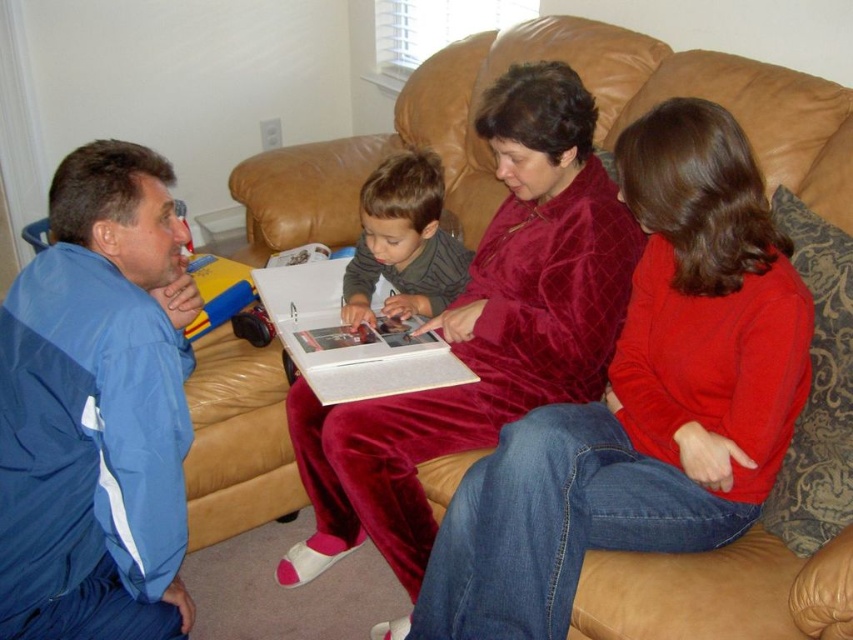
Question: In this image, where is velvet red sweater at center located relative to velvet maroon pajamas at center?

Choices:
 (A) right
 (B) left

Answer: (A)

Question: Is velvet red sweater at center closer to camera compared to velvet-like sweater at center?

Choices:
 (A) no
 (B) yes

Answer: (B)

Question: Which object is farther from the camera taking this photo?

Choices:
 (A) velvet maroon pajamas at center
 (B) blue fabric jacket at lower left

Answer: (A)

Question: Which point is closer to the camera?

Choices:
 (A) (144, 602)
 (B) (633, 204)
 (C) (370, 500)
 (D) (410, 211)

Answer: (B)

Question: Which object is the farthest from the velvet red sweater at center?

Choices:
 (A) blue fabric jacket at lower left
 (B) velvet maroon pajamas at center

Answer: (A)

Question: Considering the relative positions of velvet red sweater at center and velvet maroon pajamas at center in the image provided, where is velvet red sweater at center located with respect to velvet maroon pajamas at center?

Choices:
 (A) below
 (B) above

Answer: (A)